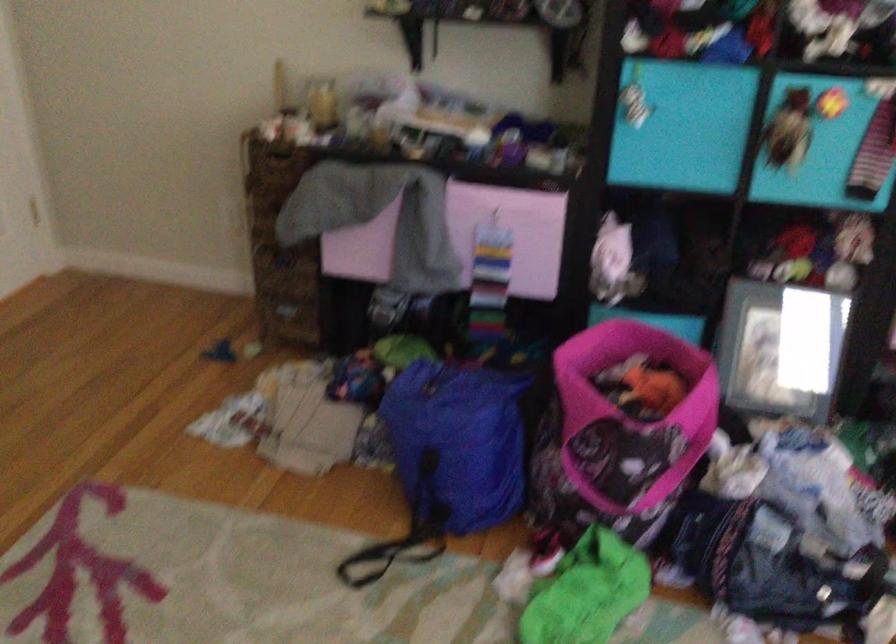
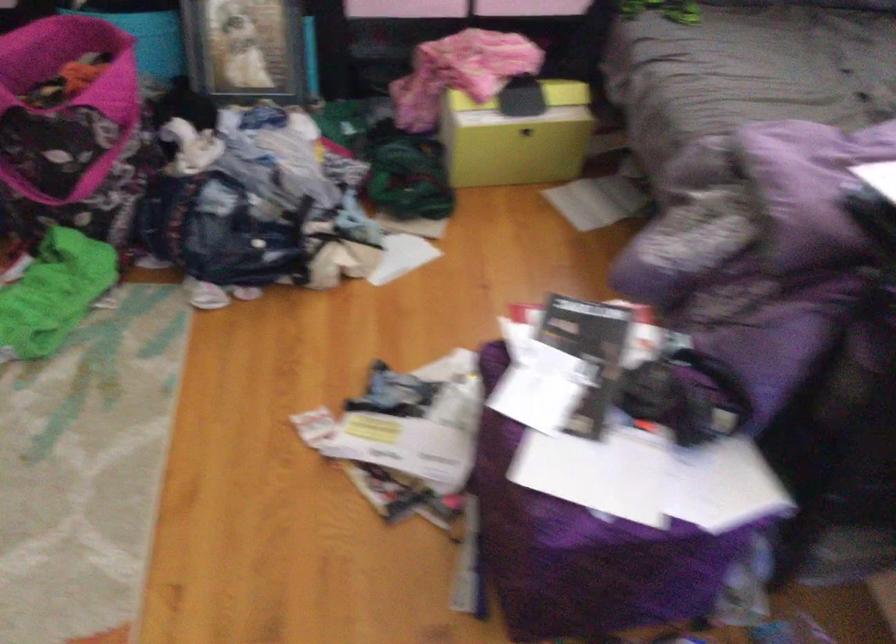
Where in the second image is the point corresponding to pixel 698 384 from the first image?

(124, 67)